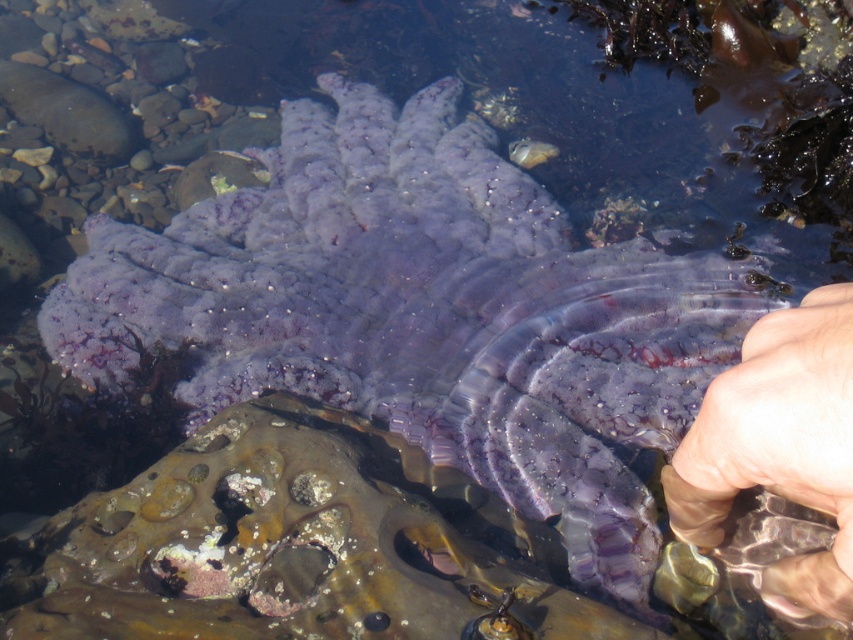
How far apart are pale skin/fleshy hand at lower right and translucent rubber fish at center?

pale skin/fleshy hand at lower right and translucent rubber fish at center are 6.34 feet apart.

Describe the element at coordinates (776, 435) in the screenshot. Image resolution: width=853 pixels, height=640 pixels. I see `pale skin/fleshy hand at lower right` at that location.

Identify the location of pale skin/fleshy hand at lower right. (776, 435).